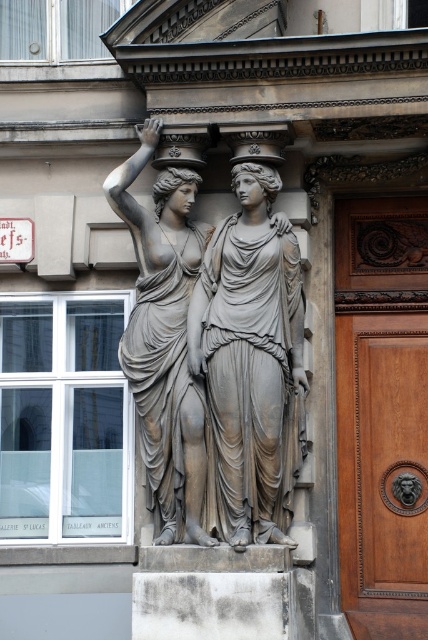
How distant is gray stone statue at center from bronze statue at center?

gray stone statue at center is 6.76 feet from bronze statue at center.

Find the location of `gray stone statue at center`. gray stone statue at center is located at coordinates (252, 360).

The image size is (428, 640). What are the coordinates of `gray stone statue at center` in the screenshot? It's located at (252, 360).

The height and width of the screenshot is (640, 428). Identify the location of gray stone statue at center. (252, 360).

Does brown polished wood door at right have a greater height compared to gray stone statue at center?

Correct, brown polished wood door at right is much taller as gray stone statue at center.

Between point (353, 464) and point (255, 257), which one is positioned in front?

Positioned in front is point (255, 257).

Where is `brown polished wood door at right`? The image size is (428, 640). brown polished wood door at right is located at coordinates (382, 413).

Consider the image. Does brown polished wood door at right have a greater height compared to bronze statue at center?

Indeed, brown polished wood door at right has a greater height compared to bronze statue at center.

What do you see at coordinates (382, 413) in the screenshot?
I see `brown polished wood door at right` at bounding box center [382, 413].

Locate an element on the screen. This screenshot has width=428, height=640. brown polished wood door at right is located at coordinates (382, 413).